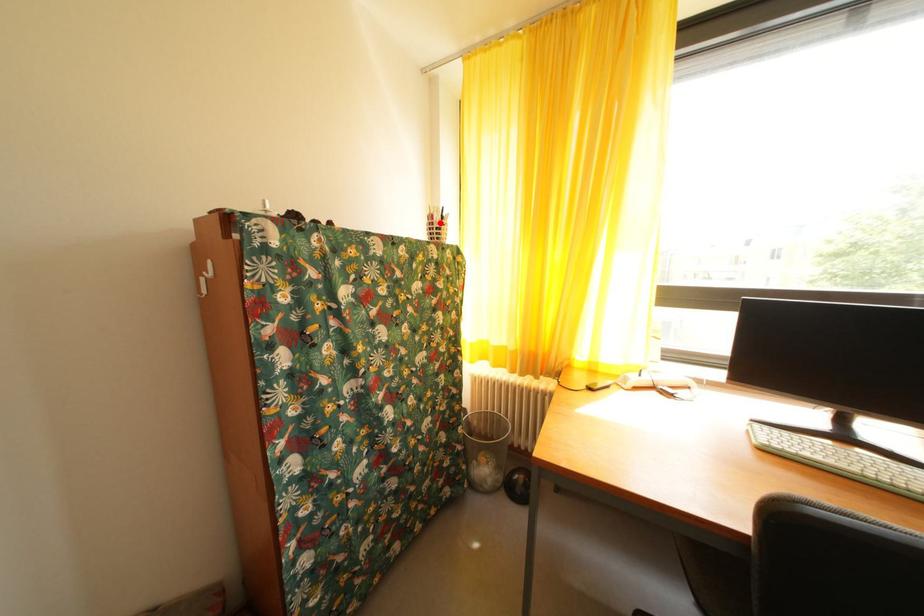
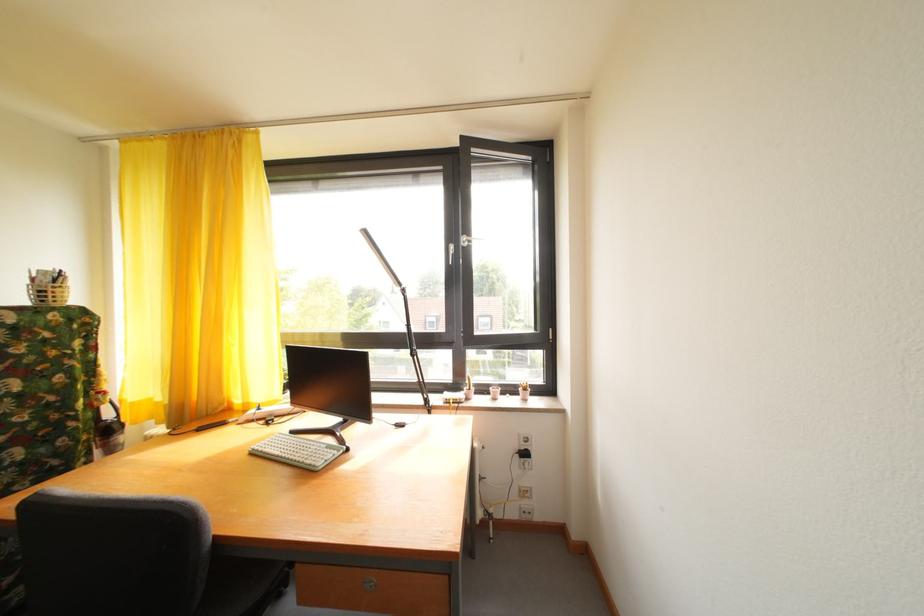
Find the pixel in the second image that matches the highlighted location in the first image.

(43, 286)